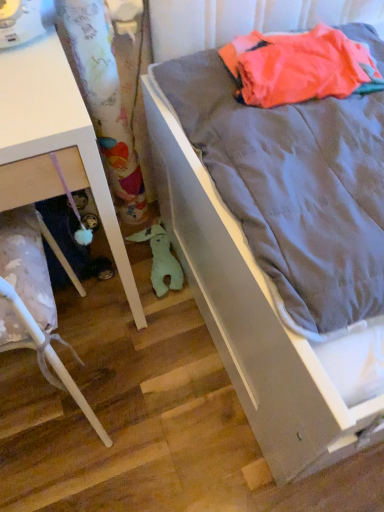
Find the location of `vacant space to the left of green plush toy at lower center`. vacant space to the left of green plush toy at lower center is located at coordinates (100, 286).